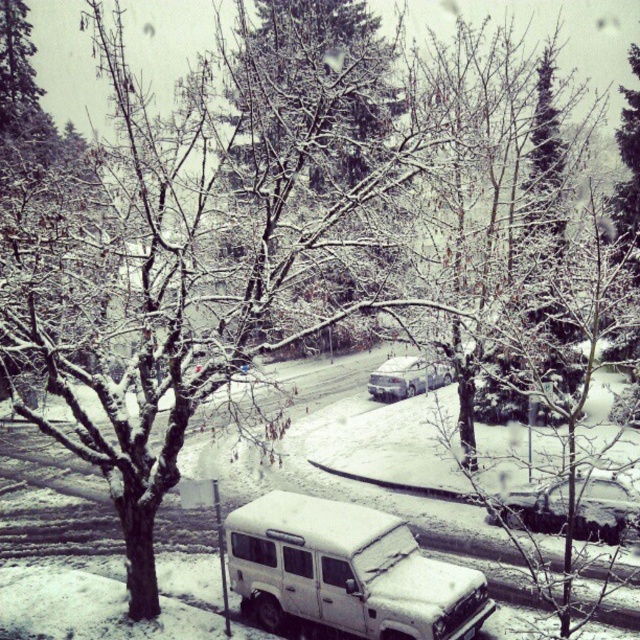
Is snow-covered car at lower right to the right of white matte sedan at center from the viewer's perspective?

Indeed, snow-covered car at lower right is positioned on the right side of white matte sedan at center.

In the scene shown: Can you confirm if snow-covered car at lower right is positioned to the left of white matte sedan at center?

In fact, snow-covered car at lower right is to the right of white matte sedan at center.

Between point (609, 524) and point (400, 387), which one is positioned behind?

The point (400, 387) is more distant.

The width and height of the screenshot is (640, 640). I want to click on snow-covered car at lower right, so click(605, 506).

Between point (292, 528) and point (376, 397), which one is positioned behind?

The point (376, 397) is behind.

Is snow-covered white suv at lower center below white matte sedan at center?

Yes.

Who is more distant from viewer, (424, 602) or (436, 381)?

The point (436, 381) is more distant.

Identify the location of snow-covered white suv at lower center. The width and height of the screenshot is (640, 640). (346, 572).

Measure the distance from snow-covered white suv at lower center to snow-covered car at lower right.

snow-covered white suv at lower center is 4.75 meters from snow-covered car at lower right.

This screenshot has height=640, width=640. Describe the element at coordinates (346, 572) in the screenshot. I see `snow-covered white suv at lower center` at that location.

At what (x,y) coordinates should I click in order to perform the action: click on snow-covered white suv at lower center. Please return your answer as a coordinate pair (x, y). The width and height of the screenshot is (640, 640). Looking at the image, I should click on (346, 572).